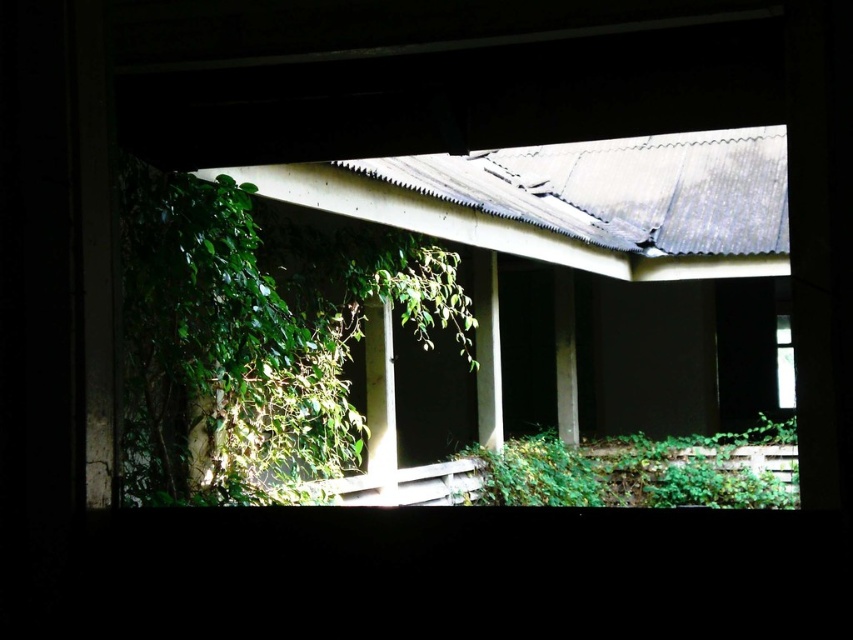
Question: Does green leafy plant at left appear on the left side of green leafy plant at lower right?

Choices:
 (A) yes
 (B) no

Answer: (A)

Question: Which point is farther from the camera taking this photo?

Choices:
 (A) (767, 492)
 (B) (302, 456)

Answer: (A)

Question: Is green leafy plant at left to the left of green leafy plant at lower right from the viewer's perspective?

Choices:
 (A) yes
 (B) no

Answer: (A)

Question: Among these objects, which one is nearest to the camera?

Choices:
 (A) green leafy plant at lower right
 (B) green leafy plant at left

Answer: (B)

Question: Which of the following is the farthest from the observer?

Choices:
 (A) (x=469, y=321)
 (B) (x=483, y=454)

Answer: (B)

Question: Is green leafy plant at left bigger than green leafy plant at lower right?

Choices:
 (A) yes
 (B) no

Answer: (A)